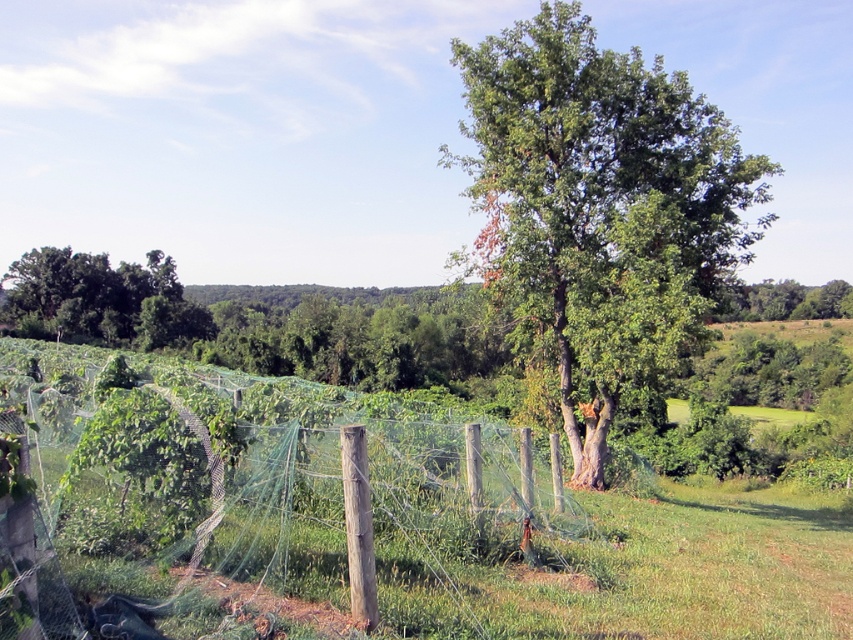
You are standing at the origin point in the image. Where is the green leafy tree at center located?

The green leafy tree at center is located at point 0.325 on the x axis and 0.705 on the y axis.